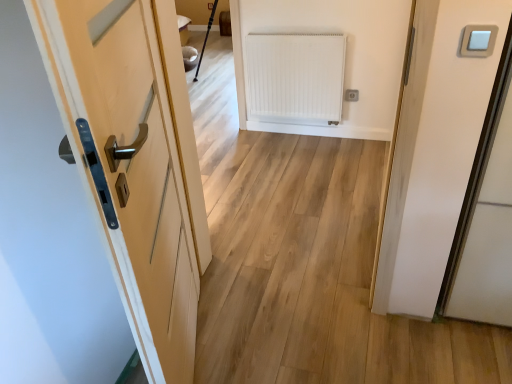
Find the location of `free location above white matte radiator at center (from a real-world perspective)`. free location above white matte radiator at center (from a real-world perspective) is located at coordinates 288,33.